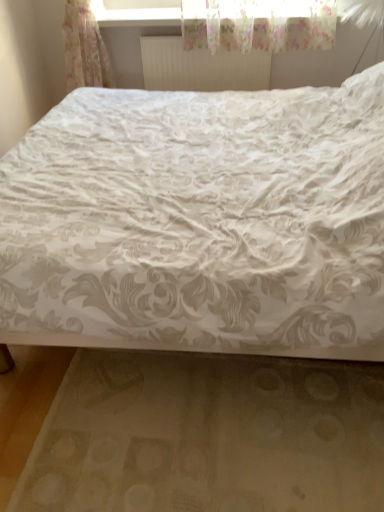
Question: Is the depth of white fabric bed frame at lower center greater than that of white floral fabric bed at center?

Choices:
 (A) no
 (B) yes

Answer: (B)

Question: Is white fabric bed frame at lower center positioned beyond the bounds of white floral fabric bed at center?

Choices:
 (A) yes
 (B) no

Answer: (B)

Question: Is white fabric bed frame at lower center shorter than white floral fabric bed at center?

Choices:
 (A) no
 (B) yes

Answer: (B)

Question: Are white fabric bed frame at lower center and white floral fabric bed at center far apart?

Choices:
 (A) yes
 (B) no

Answer: (B)

Question: Is white floral fabric bed at center surrounded by white fabric bed frame at lower center?

Choices:
 (A) no
 (B) yes

Answer: (A)

Question: From a real-world perspective, is white matte radiator at upper center positioned above or below white floral fabric bed at center?

Choices:
 (A) below
 (B) above

Answer: (B)

Question: Is white matte radiator at upper center to the left or to the right of white floral fabric bed at center in the image?

Choices:
 (A) left
 (B) right

Answer: (A)

Question: In terms of width, does white matte radiator at upper center look wider or thinner when compared to white floral fabric bed at center?

Choices:
 (A) thin
 (B) wide

Answer: (A)

Question: From the image's perspective, is white matte radiator at upper center located above or below white floral fabric bed at center?

Choices:
 (A) below
 (B) above

Answer: (B)

Question: Considering the positions of transparent plastic window frame at upper center and white fabric bed frame at lower center in the image, is transparent plastic window frame at upper center bigger or smaller than white fabric bed frame at lower center?

Choices:
 (A) small
 (B) big

Answer: (B)

Question: Is transparent plastic window frame at upper center spatially inside white fabric bed frame at lower center, or outside of it?

Choices:
 (A) inside
 (B) outside

Answer: (B)

Question: Considering the positions of transparent plastic window frame at upper center and white fabric bed frame at lower center in the image, is transparent plastic window frame at upper center wider or thinner than white fabric bed frame at lower center?

Choices:
 (A) wide
 (B) thin

Answer: (B)

Question: Based on their positions, is transparent plastic window frame at upper center located to the left or right of white fabric bed frame at lower center?

Choices:
 (A) right
 (B) left

Answer: (A)

Question: From a real-world perspective, is transparent plastic window frame at upper center positioned above or below white matte radiator at upper center?

Choices:
 (A) above
 (B) below

Answer: (A)

Question: Based on their sizes in the image, would you say transparent plastic window frame at upper center is bigger or smaller than white matte radiator at upper center?

Choices:
 (A) small
 (B) big

Answer: (B)